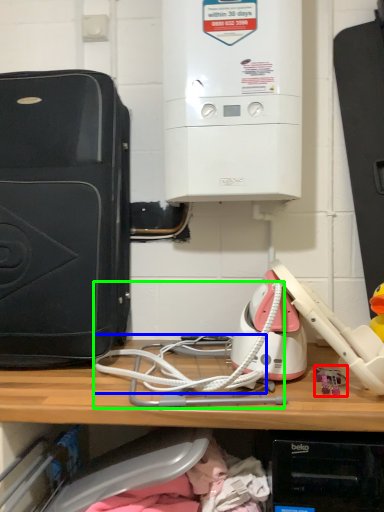
Question: Which object is positioned farthest from toy (highlighted by a red box)? Select from wire (highlighted by a blue box) and wire (highlighted by a green box).

Choices:
 (A) wire
 (B) wire

Answer: (A)